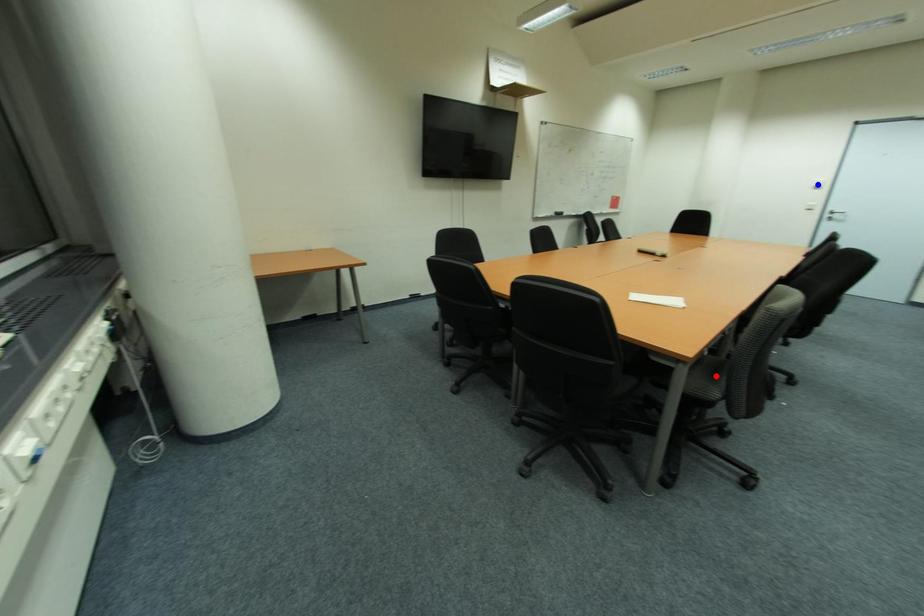
Question: In the image, two points are highlighted. Which point is nearer to the camera? Reply with the corresponding letter.

Choices:
 (A) blue point
 (B) red point

Answer: (B)